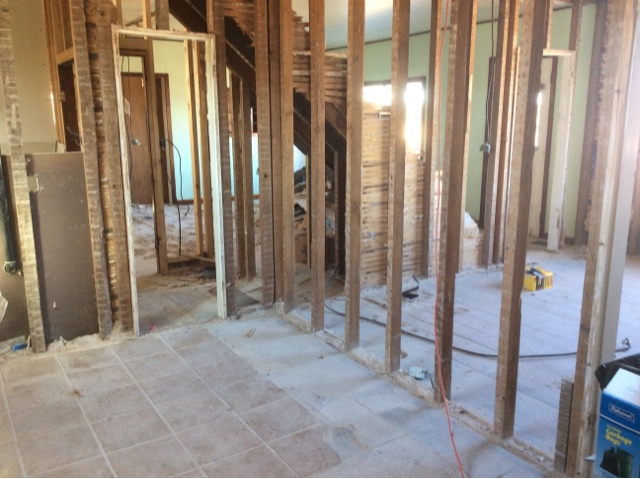
Locate an element on the screen. drywall is located at coordinates (68, 231), (13, 296).